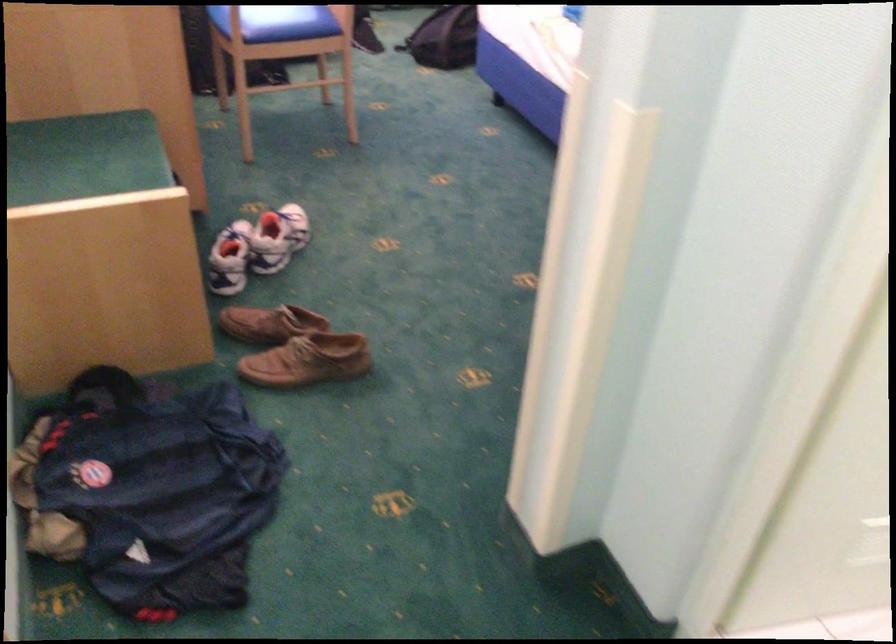
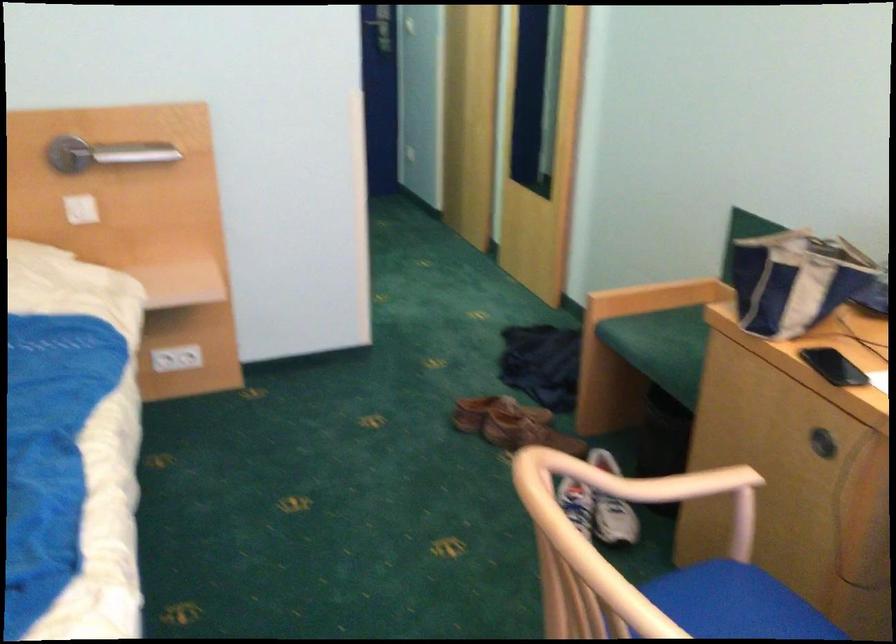
Find the pixel in the second image that matches point 254,234 in the first image.

(607, 543)